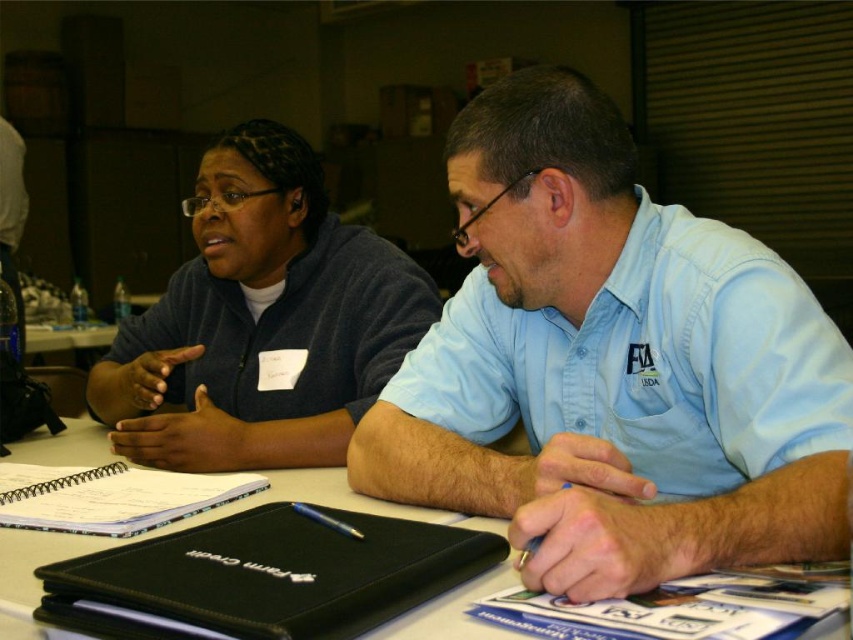
Question: Which object is farther from the camera taking this photo?

Choices:
 (A) spiral-bound paper at center
 (B) dark gray fleece jacket at upper left

Answer: (B)

Question: Can you confirm if white paper at center is wider than spiral-bound paper at center?

Choices:
 (A) no
 (B) yes

Answer: (B)

Question: Can you confirm if black leather notebook at lower center is positioned to the right of spiral-bound paper at center?

Choices:
 (A) no
 (B) yes

Answer: (B)

Question: Estimate the real-world distances between objects in this image. Which object is farther from the light blue denim shirt at center?

Choices:
 (A) dark gray fleece jacket at upper left
 (B) spiral-bound paper at center
 (C) black leather notebook at lower center
 (D) white paper at center

Answer: (A)

Question: Can you confirm if light blue denim shirt at center is wider than white paper at center?

Choices:
 (A) no
 (B) yes

Answer: (A)

Question: Which point appears farthest from the camera in this image?

Choices:
 (A) (312, 625)
 (B) (508, 250)

Answer: (B)